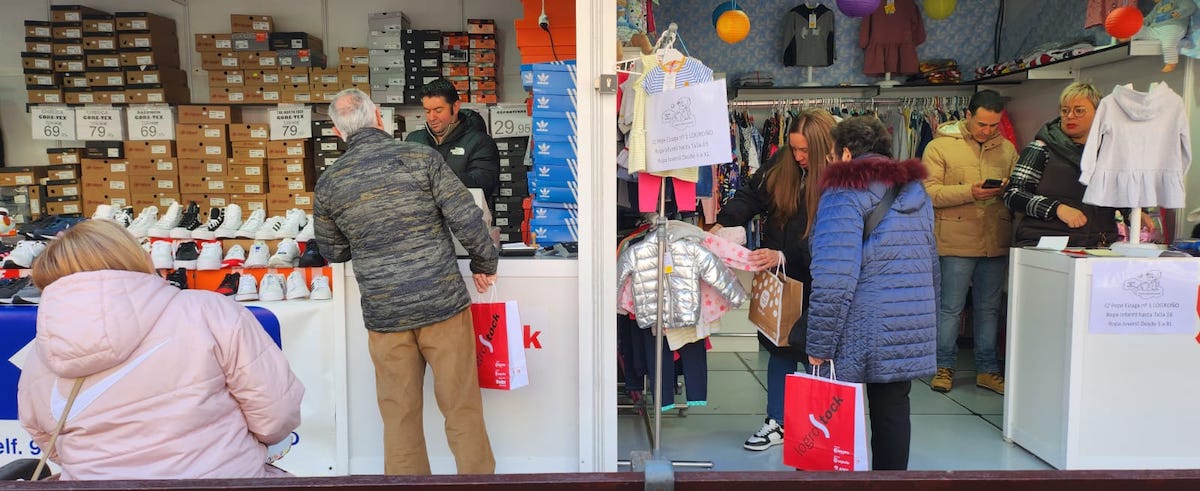
Identify the location of counter top. Image resolution: width=1200 pixels, height=491 pixels. (1038, 252).